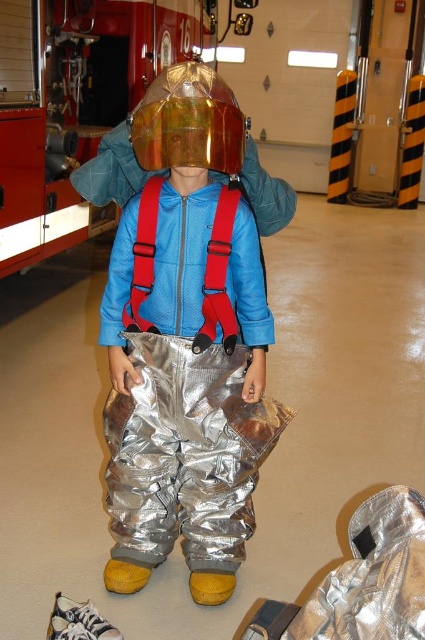
Does silver reflective pants at center have a greater height compared to transparent plastic helmet at center?

Correct, silver reflective pants at center is much taller as transparent plastic helmet at center.

Who is higher up, silver reflective pants at center or transparent plastic helmet at center?

Positioned higher is transparent plastic helmet at center.

Is point (226, 128) behind point (238, 170)?

No, (226, 128) is closer to viewer.

Locate an element on the screen. The image size is (425, 640). silver reflective pants at center is located at coordinates (184, 147).

Can you confirm if brushed metal fire truck at upper center is positioned to the right of silver reflective pants at center?

Incorrect, brushed metal fire truck at upper center is not on the right side of silver reflective pants at center.

Which is behind, point (59, 16) or point (192, 106)?

Positioned behind is point (59, 16).

You are a GUI agent. You are given a task and a screenshot of the screen. Output one action in this format:
    pyautogui.click(x=<x>, y=<y>)
    Task: Click on the brushed metal fire truck at upper center
    The image size is (425, 640).
    Given the screenshot: What is the action you would take?
    pyautogui.click(x=30, y=147)

Looking at this image, can you confirm if brushed metal fire truck at upper center is positioned to the left of transparent plastic helmet at center?

Yes, brushed metal fire truck at upper center is to the left of transparent plastic helmet at center.

Is brushed metal fire truck at upper center above transparent plastic helmet at center?

Yes.

Identify the location of brushed metal fire truck at upper center. This screenshot has width=425, height=640. (30, 147).